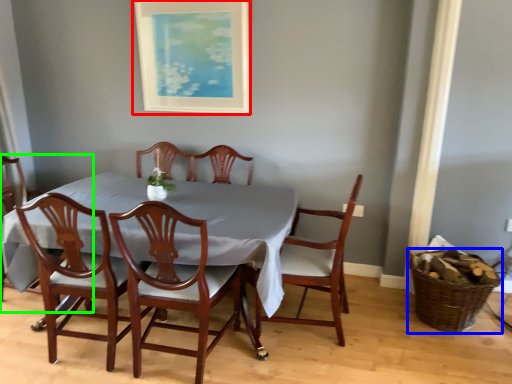
Question: Estimate the real-world distances between objects in this image. Which object is farther from picture frame (highlighted by a red box), basket (highlighted by a blue box) or chair (highlighted by a green box)?

Choices:
 (A) basket
 (B) chair

Answer: (A)